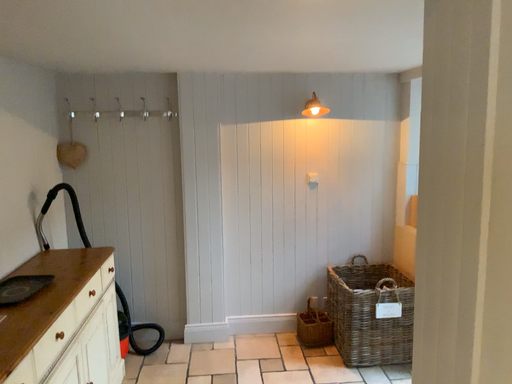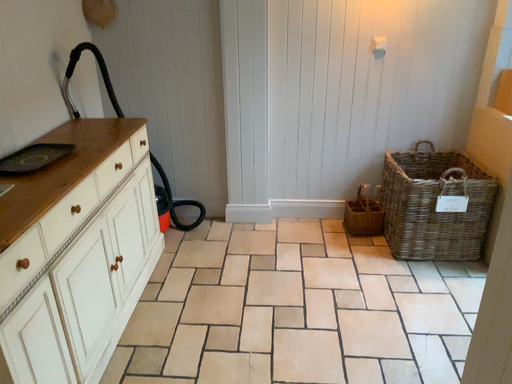
Question: Which way did the camera rotate in the video?

Choices:
 (A) rotated left
 (B) rotated right

Answer: (A)